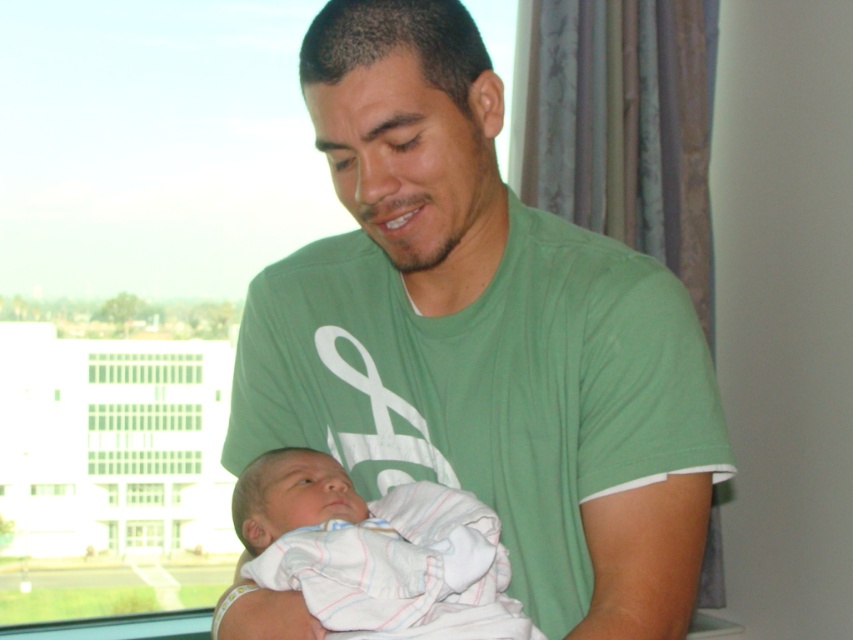
Between green cotton shirt at center and white striped cloth at center, which one is positioned higher?

green cotton shirt at center

Which is in front, point (705, 340) or point (511, 620)?

Point (511, 620) is more forward.

Which is in front, point (433, 35) or point (480, 604)?

Positioned in front is point (433, 35).

I want to click on green cotton shirt at center, so click(482, 337).